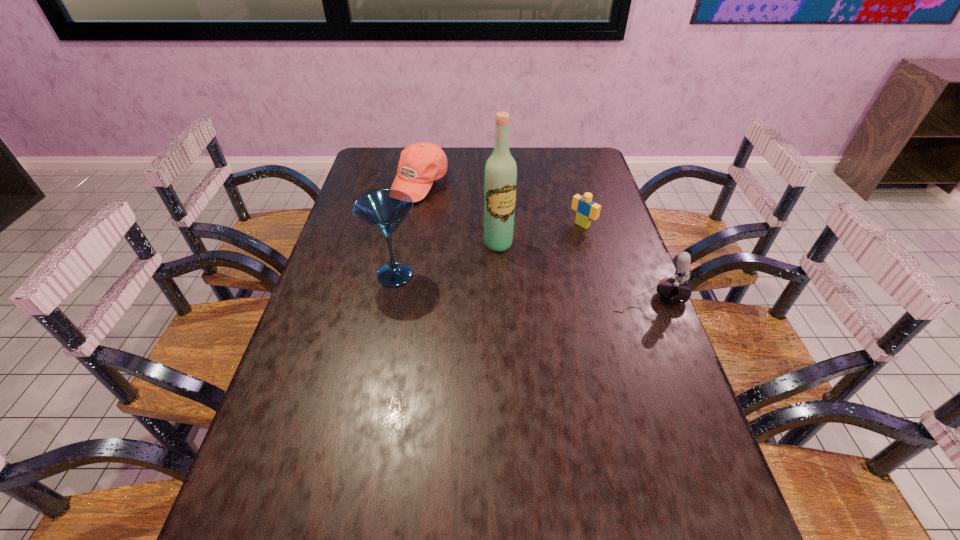
Find the location of a particular element. The height and width of the screenshot is (540, 960). baseball cap at the left edge is located at coordinates (420, 164).

Find the location of `microphone present at the right edge`. microphone present at the right edge is located at coordinates (674, 290).

This screenshot has height=540, width=960. What are the coordinates of `Lego that is at the right edge` in the screenshot? It's located at (587, 210).

Where is `object situated at the far left corner`? The width and height of the screenshot is (960, 540). object situated at the far left corner is located at coordinates (420, 164).

The image size is (960, 540). In order to click on vacant area at the far edge of the desktop in this screenshot , I will do `click(449, 172)`.

Locate an element on the screen. This screenshot has width=960, height=540. free region at the near edge of the desktop is located at coordinates (434, 475).

You are a GUI agent. You are given a task and a screenshot of the screen. Output one action in this format:
    pyautogui.click(x=<x>, y=<y>)
    Task: Click on the vacant space at the left edge of the desktop
    The image size is (960, 540).
    Given the screenshot: What is the action you would take?
    pyautogui.click(x=256, y=458)

Where is `free space at the right edge of the desktop`? The height and width of the screenshot is (540, 960). free space at the right edge of the desktop is located at coordinates (636, 301).

At what (x,y) coordinates should I click in order to perform the action: click on vacant space at the far left corner of the desktop. Please return your answer as a coordinate pair (x, y). The width and height of the screenshot is (960, 540). Looking at the image, I should click on (361, 167).

Where is `vacant region at the far right corner of the desktop`? vacant region at the far right corner of the desktop is located at coordinates pyautogui.click(x=599, y=172).